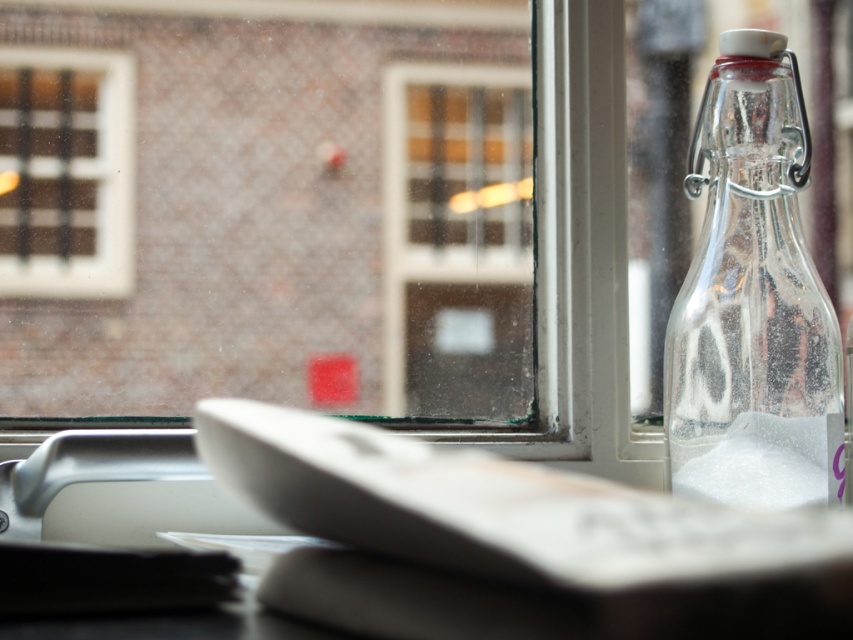
You are holding a drone that is 20 inches wide. You want to fly it through the space between the clear glass bottle at right and the camera. Is there enough space for the drone to pass through without touching anything?

The distance between the clear glass bottle at right and the camera is 22.32 inches. Since the drone is 20 inches wide, there is enough space for it to pass through without touching anything.

You are standing in front of the window and see two points marked in the image. Which point is closer to you, point (x=734, y=70) or point (x=491, y=394)?

Point (x=734, y=70) is closer to the viewer than point (x=491, y=394).

You are a photographer adjusting your camera settings to focus on two points in the scene. The first point is at coordinate point (816, 304) and the second is at point (18, 65). Since you can only focus on one point clearly, which point should you choose to ensure the foreground elements like the table and glass bottle are sharp?

Point (816, 304) is closer to the camera than point (18, 65). To ensure the foreground elements like the table and glass bottle are sharp, you should focus on point (816, 304) because it is closer to the camera.